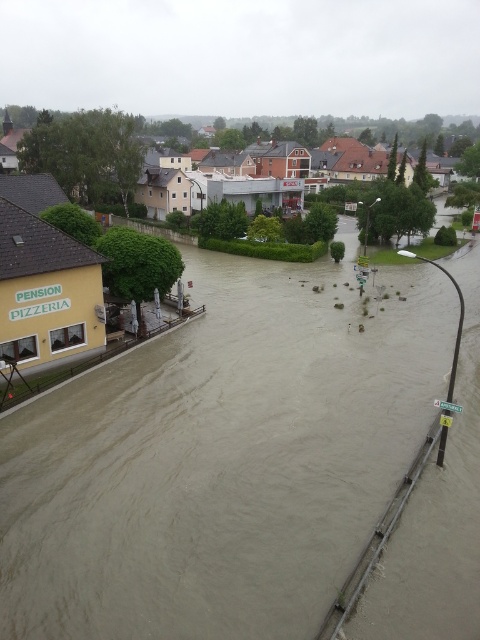
Question: Is brown muddy water at lower center behind brown wooden houses at center?

Choices:
 (A) no
 (B) yes

Answer: (A)

Question: Considering the relative positions of yellow building at left and brown wooden houses at center in the image provided, where is yellow building at left located with respect to brown wooden houses at center?

Choices:
 (A) left
 (B) right

Answer: (B)

Question: Which of the following is the farthest from the observer?

Choices:
 (A) (408, 157)
 (B) (19, 593)
 (C) (201, 211)

Answer: (A)

Question: Is yellow building at left thinner than brown wooden houses at center?

Choices:
 (A) yes
 (B) no

Answer: (A)

Question: Which point is closer to the camera?

Choices:
 (A) (248, 161)
 (B) (152, 566)

Answer: (B)

Question: Which of the following is the farthest from the observer?

Choices:
 (A) brown muddy water at lower center
 (B) yellow building at left
 (C) brown wooden houses at center

Answer: (C)